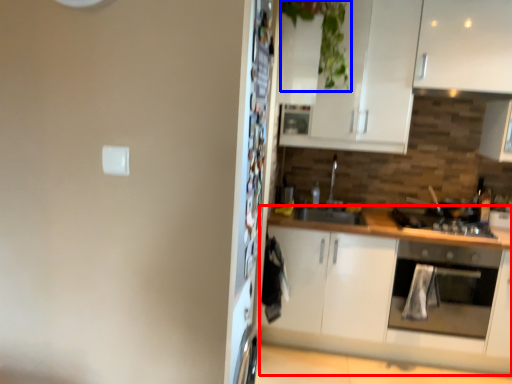
Question: Which of the following is the closest to the observer, cabinetry (highlighted by a red box) or plant (highlighted by a blue box)?

Choices:
 (A) cabinetry
 (B) plant

Answer: (B)